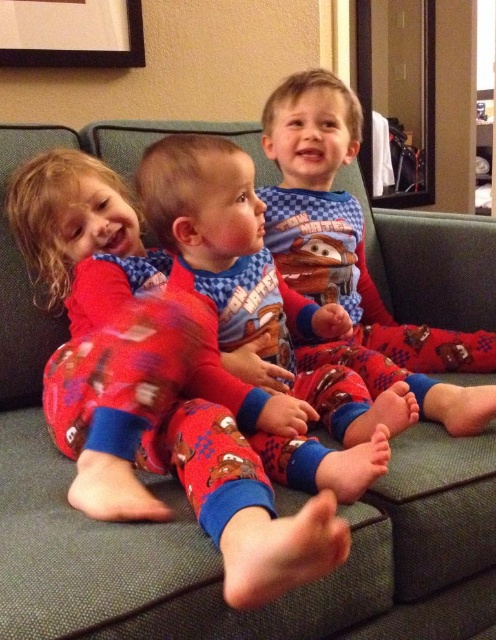
Based on the scene description, where exactly is the matte blue pajamas at center located in terms of coordinates?

The matte blue pajamas at center are located at coordinates point (354, 257).

You are a photographer trying to capture a group photo of the children on the green sofa. The children are wearing two sets of pajamas labeled as matte blue pajamas at center and matte red pajamas at center. Considering the space they occupy, which set of pajamas is wider?

The matte blue pajamas at center are wider than the matte red pajamas at center, as stated in the description.